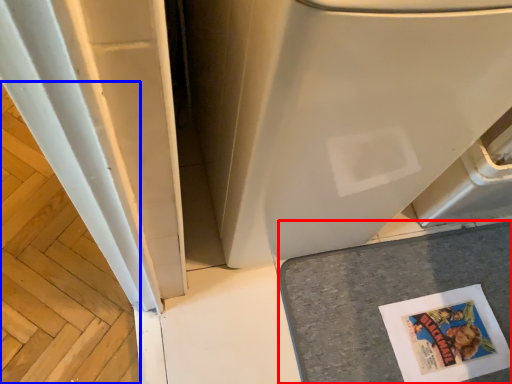
Question: Which object appears farthest to the camera in this image, counter top (highlighted by a red box) or wood (highlighted by a blue box)?

Choices:
 (A) counter top
 (B) wood

Answer: (B)